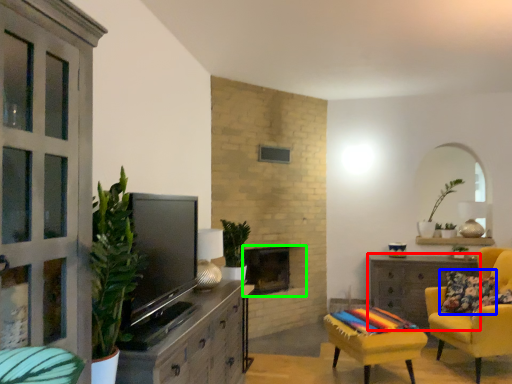
Question: Which object is positioned farthest from desk (highlighted by a red box)? Select from pillow (highlighted by a blue box) and fireplace (highlighted by a green box).

Choices:
 (A) pillow
 (B) fireplace

Answer: (B)